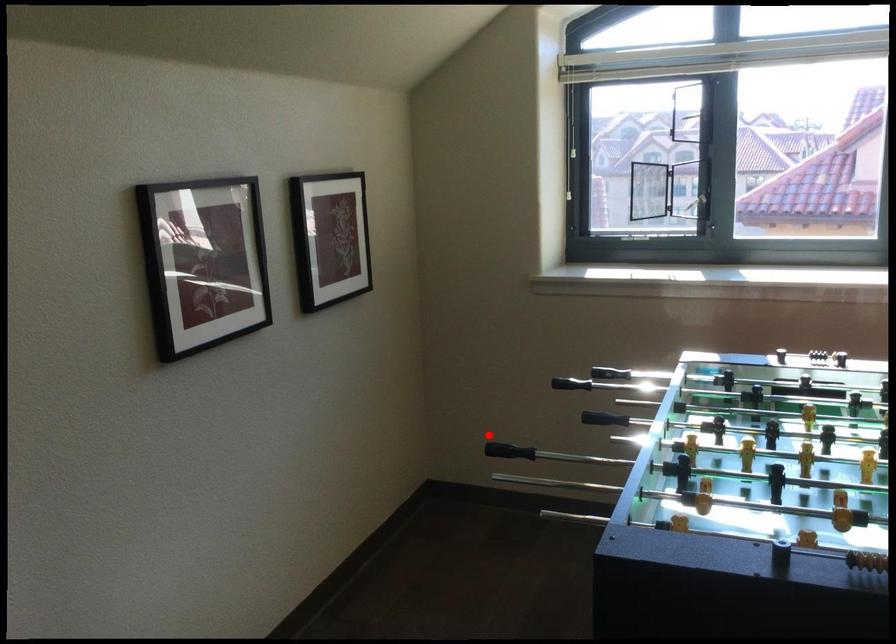
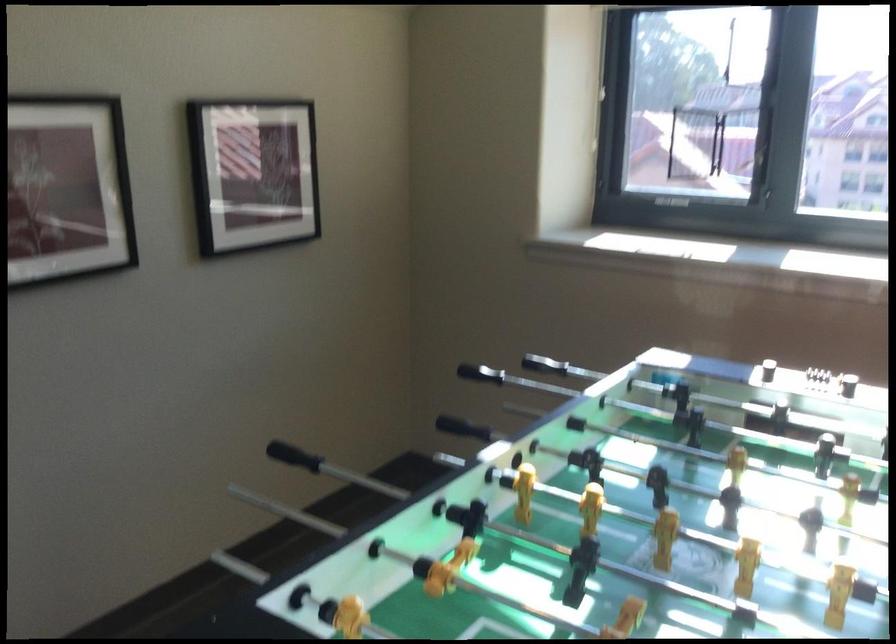
Find the pixel in the second image that matches the highlighted location in the first image.

(463, 428)